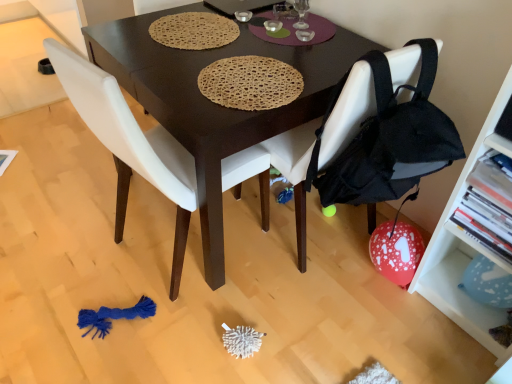
Identify the location of free location to the left of white matte shelf at right. tap(393, 326).